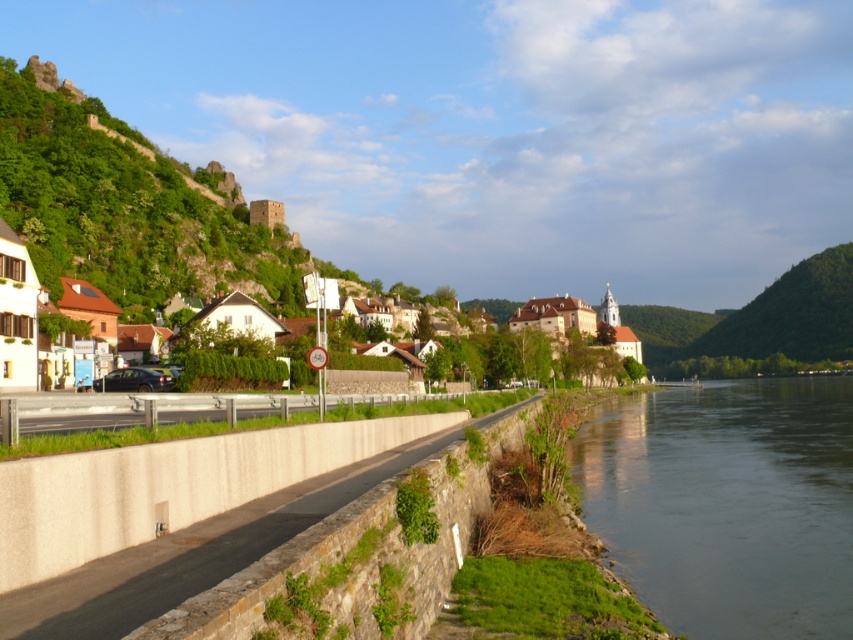
Question: Is green grassy riverbank at lower right smaller than white matte houses at center?

Choices:
 (A) no
 (B) yes

Answer: (B)

Question: Among these objects, which one is nearest to the camera?

Choices:
 (A) white matte houses at center
 (B) green grassy riverbank at lower right

Answer: (B)

Question: Which point is closer to the camera taking this photo?

Choices:
 (A) (61, 296)
 (B) (759, 568)

Answer: (B)

Question: Which object is farther from the camera taking this photo?

Choices:
 (A) green grassy riverbank at lower right
 (B) white matte houses at center

Answer: (B)

Question: Can you confirm if green grassy riverbank at lower right is wider than white matte houses at center?

Choices:
 (A) yes
 (B) no

Answer: (B)

Question: Observing the image, what is the correct spatial positioning of green grassy riverbank at lower right in reference to white matte houses at center?

Choices:
 (A) above
 (B) below

Answer: (B)